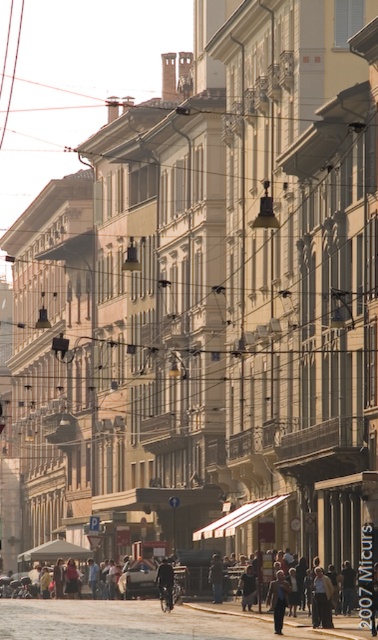
You are a delivery person trying to park your shiny black car at center in a narrow alleyway. The alleyway is only as wide as the dark blue jeans at center. Will your car fit?

The shiny black car at center is wider than the dark blue jeans at center, so the car will not fit in the alleyway that is as wide as the dark blue jeans at center.

You are a fashion designer observing a pedestrian in the European city street scene. The pedestrian is wearing dark blue jeans at center and dark blue fabric jacket at center. Which clothing item is positioned higher on the pedestrian?

The dark blue jeans at center is located above the dark blue fabric jacket at center, so the dark blue jeans at center is positioned higher on the pedestrian.

You are a tourist standing at the entrance of the street and want to take a photo of the shiny black car at center. The camera you have can focus up to 100 meters. Will the car be in focus?

The shiny black car at center is 91.01 meters away from the camera. Since the camera can focus up to 100 meters, the car is within the focus range and will be in focus.